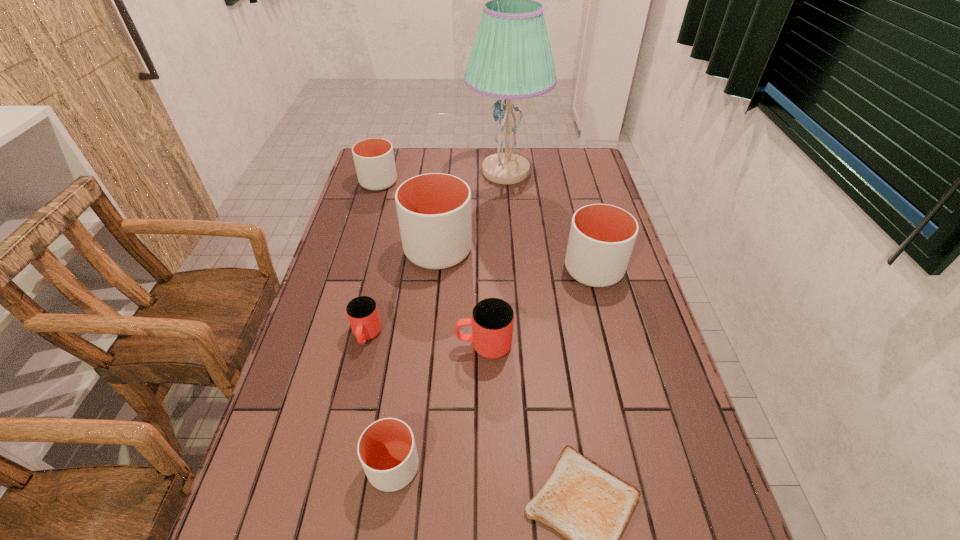
What are the coordinates of `free space located 0.320m on the handle side of the left pink cup` in the screenshot? It's located at (333, 482).

You are a GUI agent. You are given a task and a screenshot of the screen. Output one action in this format:
    pyautogui.click(x=<x>, y=<y>)
    Task: Click on the lamp situated at the far edge
    This screenshot has height=540, width=960.
    Given the screenshot: What is the action you would take?
    pyautogui.click(x=511, y=58)

Identify the location of cup that is at the far edge. (374, 160).

Where is `object present at the right edge`? object present at the right edge is located at coordinates 602,237.

I want to click on object present at the far left corner, so click(x=374, y=160).

This screenshot has width=960, height=540. In the image, there is a desktop. Identify the location of vacant space at the far edge. (465, 160).

The image size is (960, 540). I want to click on vacant space at the left edge, so click(311, 335).

The image size is (960, 540). Identify the location of free space at the right edge of the desktop. (597, 186).

Where is `blank area at the far right corner`? blank area at the far right corner is located at coordinates (589, 178).

At what (x,y) coordinates should I click in order to perform the action: click on vacant area that lies between the sixth shortest object and the teal lamp. Please return your answer as a coordinate pair (x, y). The height and width of the screenshot is (540, 960). Looking at the image, I should click on (550, 220).